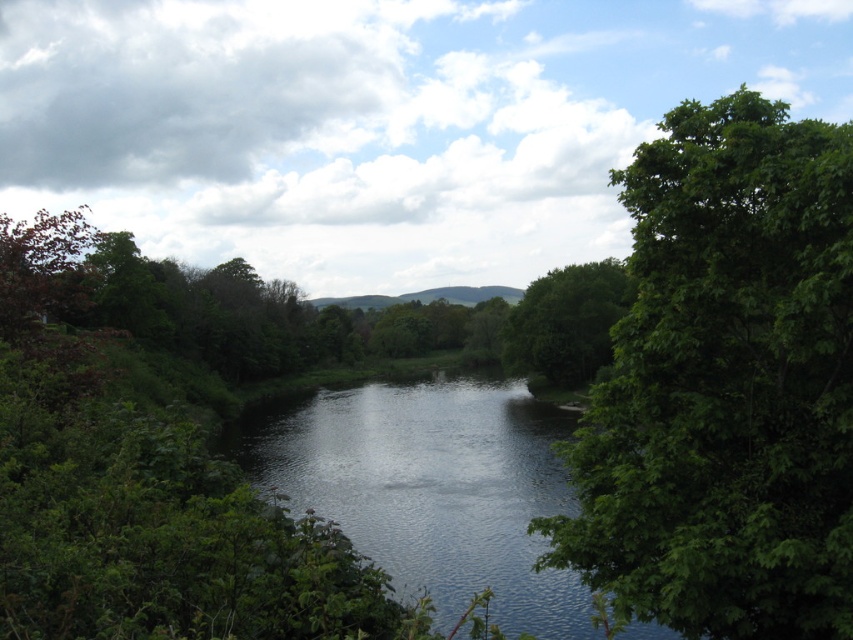
You are standing at the edge of the river and see two green leafy trees. Which tree is closer to your left side, the green leafy tree at right or the green leafy tree at center?

The green leafy tree at right is positioned on the left side of green leafy tree at center, so the green leafy tree at right is closer to your left side.

You are a bird looking for a nesting spot. You see two trees in the image, the green leafy tree at right and the green leafy tree at center. Which tree is located closer to the ground?

The green leafy tree at right is positioned under the green leafy tree at center, so the green leafy tree at right is closer to the ground.